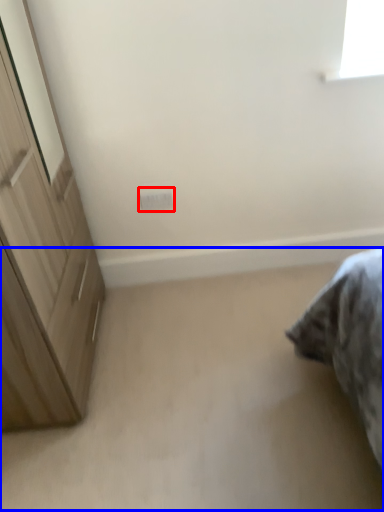
Question: Which object appears farthest to the camera in this image, electric outlet (highlighted by a red box) or plain (highlighted by a blue box)?

Choices:
 (A) electric outlet
 (B) plain

Answer: (A)